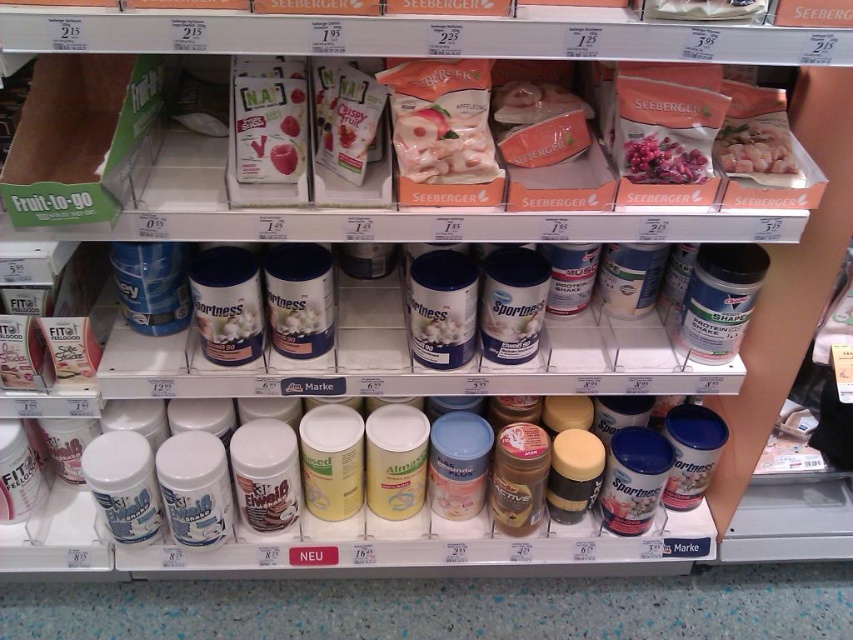
Question: Estimate the real-world distances between objects in this image. Which object is closer to the white glossy chicken at upper right?

Choices:
 (A) pink matte snack at center
 (B) matte white yogurt at center

Answer: (A)

Question: Is pink matte snack at center further to the viewer compared to pink matte dried fruit at center?

Choices:
 (A) yes
 (B) no

Answer: (B)

Question: Among these objects, which one is nearest to the camera?

Choices:
 (A) pink matte snack at center
 (B) pink matte dried fruit at center
 (C) white glossy chicken at upper right
 (D) matte white yogurt at center

Answer: (A)

Question: Can you confirm if white glossy chicken at upper right is thinner than matte white yogurt at center?

Choices:
 (A) yes
 (B) no

Answer: (B)

Question: Can you confirm if pink matte snack at center is positioned to the right of white glossy chicken at upper right?

Choices:
 (A) yes
 (B) no

Answer: (B)

Question: Which object appears farthest from the camera in this image?

Choices:
 (A) white glossy chicken at upper right
 (B) pink matte dried fruit at center
 (C) matte white yogurt at center
 (D) pink matte snack at center

Answer: (A)